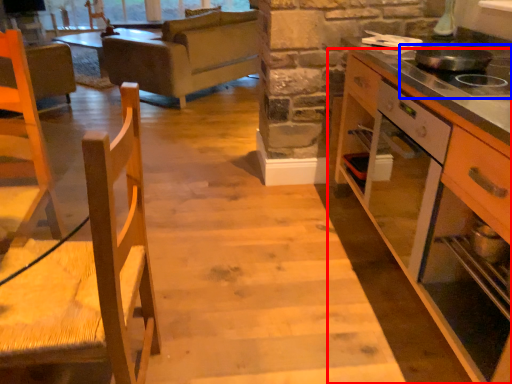
Question: Which object is further to the camera taking this photo, cabinetry (highlighted by a red box) or gas stove (highlighted by a blue box)?

Choices:
 (A) cabinetry
 (B) gas stove

Answer: (B)